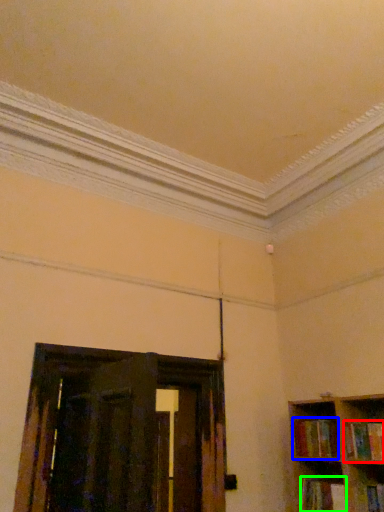
Question: Which object is the farthest from book (highlighted by a red box)? Choose among these: book (highlighted by a blue box) or book (highlighted by a green box).

Choices:
 (A) book
 (B) book

Answer: (B)